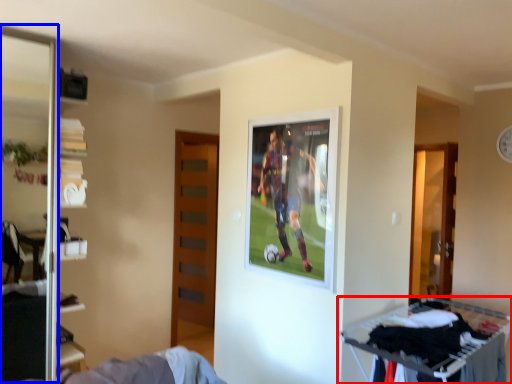
Question: Which point is closer to the camera, furniture (highlighted by a red box) or screen door (highlighted by a blue box)?

Choices:
 (A) furniture
 (B) screen door

Answer: (A)